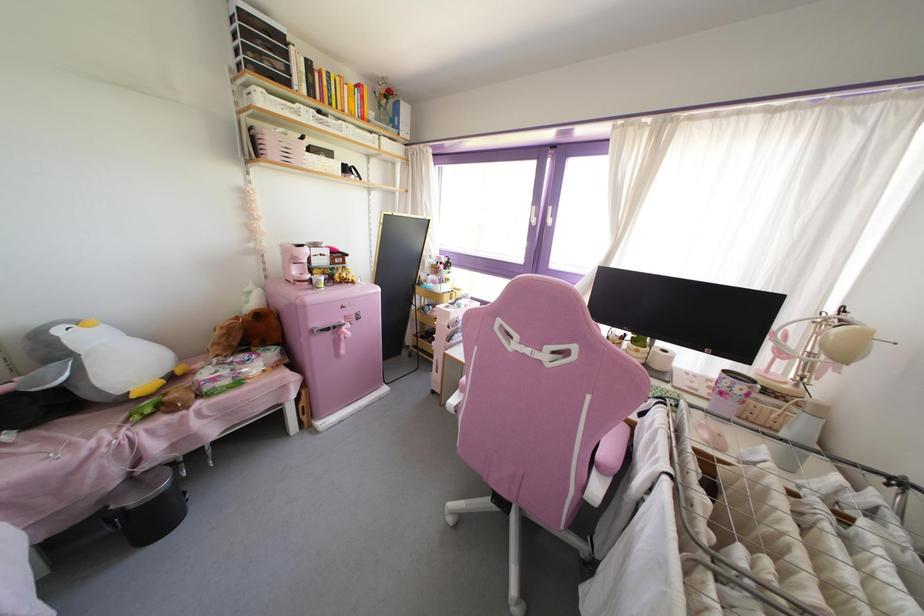
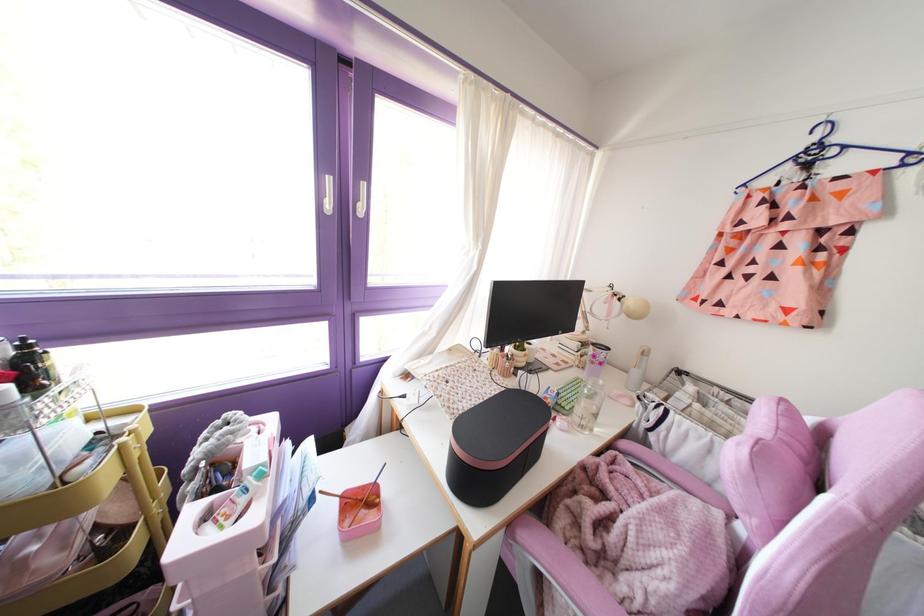
Where in the second image is the point corresponding to point 532,220 from the first image?

(329, 205)